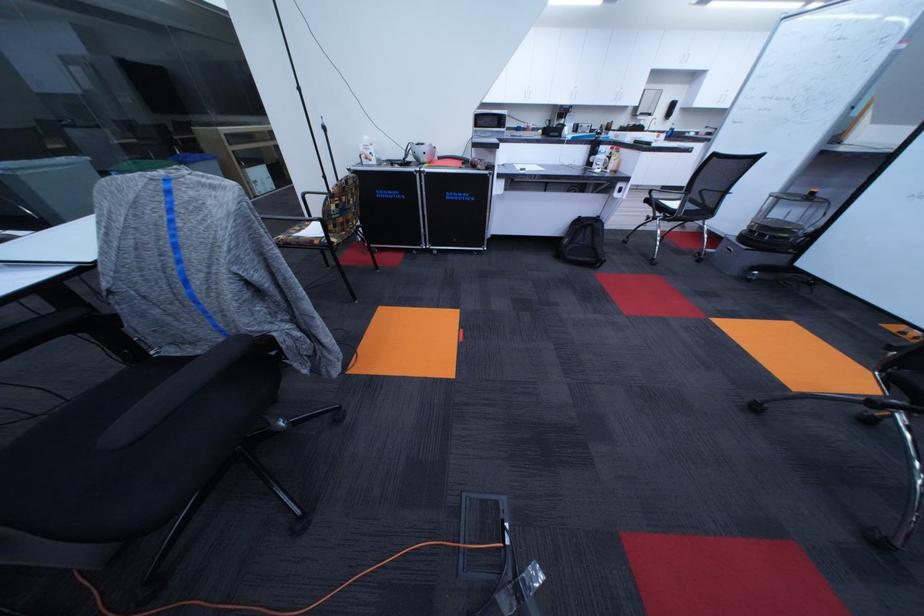
What are the coordinates of `microwave handle` in the screenshot? It's located at (524, 131).